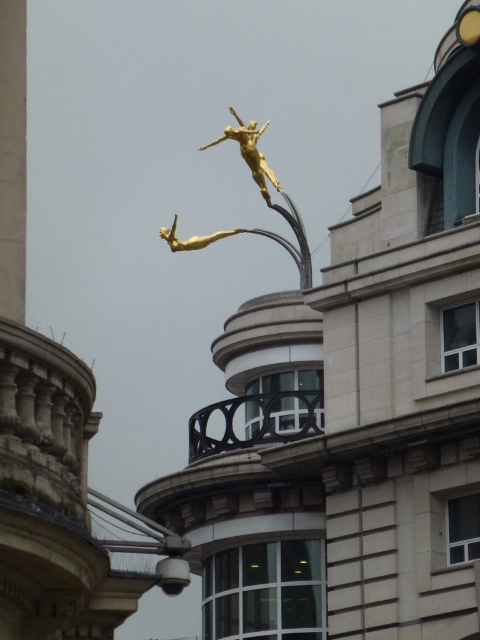
Question: Where is smooth white pillar at left located in relation to gold metallic statue at center in the image?

Choices:
 (A) below
 (B) above

Answer: (A)

Question: Estimate the real-world distances between objects in this image. Which object is farther from the smooth white pillar at left?

Choices:
 (A) gold metallic statue at upper center
 (B) gold metallic statue at center

Answer: (B)

Question: Based on their relative distances, which object is nearer to the smooth white pillar at left?

Choices:
 (A) gold metallic statue at center
 (B) gold metallic statue at upper center

Answer: (B)

Question: Does smooth white pillar at left lie in front of gold metallic statue at upper center?

Choices:
 (A) yes
 (B) no

Answer: (A)

Question: From the image, what is the correct spatial relationship of gold metallic statue at upper center in relation to gold metallic statue at center?

Choices:
 (A) right
 (B) left

Answer: (A)

Question: Which of the following is the closest to the observer?

Choices:
 (A) (12, 276)
 (B) (300, 253)

Answer: (A)